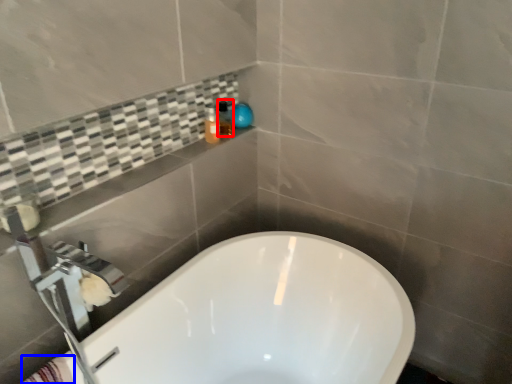
Question: Which object is closer to the camera taking this photo, toiletry (highlighted by a red box) or bath towel (highlighted by a blue box)?

Choices:
 (A) toiletry
 (B) bath towel

Answer: (B)